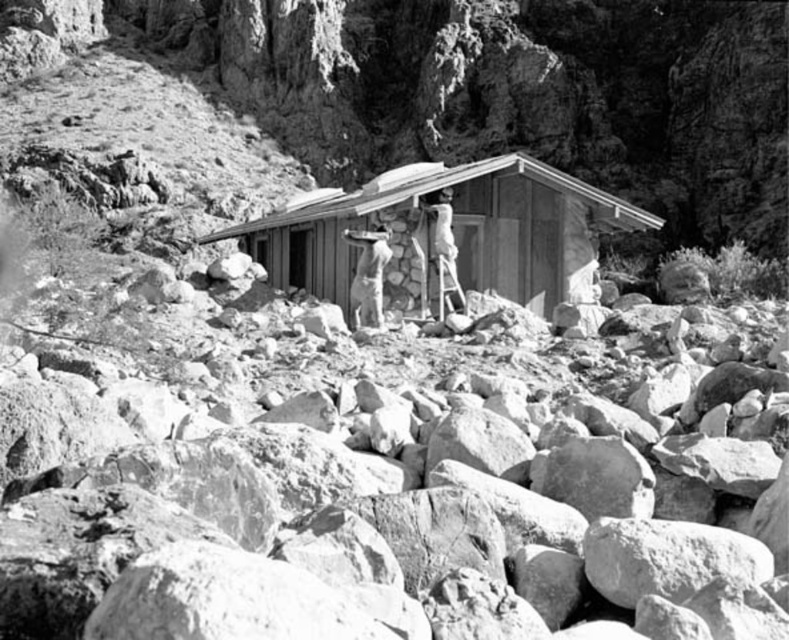
You are standing in front of the rustic cabin in the rugged terrain. You see a smooth wooden ladder at center and a smooth beige uniform at center. Which object is closer to you?

The smooth wooden ladder at center is closer to you since it is further to the viewer than the smooth beige uniform at center.

You are a hiker who wants to take a photo of the wooden cabin at center and the smooth beige uniform at center. Which object should you focus on first if you want to capture both in the same frame without moving the camera?

The wooden cabin at center is much taller than the smooth beige uniform at center, so you should focus on the wooden cabin at center first to ensure it fits entirely within the frame.